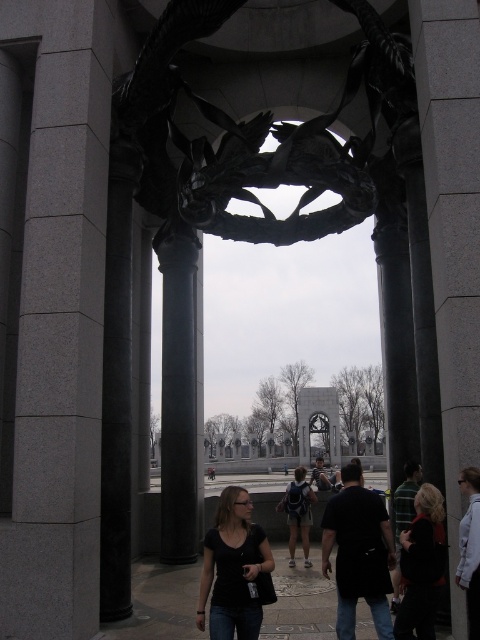
Does gray stone pillar at center appear under black polished stone column at left?

Actually, gray stone pillar at center is above black polished stone column at left.

Can you confirm if gray stone pillar at center is shorter than black polished stone column at left?

No, gray stone pillar at center is not shorter than black polished stone column at left.

This screenshot has width=480, height=640. Describe the element at coordinates (452, 220) in the screenshot. I see `gray stone pillar at center` at that location.

The height and width of the screenshot is (640, 480). What are the coordinates of `gray stone pillar at center` in the screenshot? It's located at (452, 220).

Who is higher up, gray stone pillar at center or white shirt at center?

Positioned higher is gray stone pillar at center.

Is the position of gray stone pillar at center more distant than that of white shirt at center?

Yes, it is behind white shirt at center.

Who is more distant from viewer, (439, 193) or (474, 545)?

The point (439, 193) is behind.

Locate an element on the screen. gray stone pillar at center is located at coordinates (452, 220).

Is gray granite column at left below black matte shirt at center?

No.

Is gray granite column at left above black matte shirt at center?

Correct, gray granite column at left is located above black matte shirt at center.

Is point (60, 536) closer to camera compared to point (249, 508)?

That is True.

Identify the location of gray granite column at left. The image size is (480, 640). (52, 310).